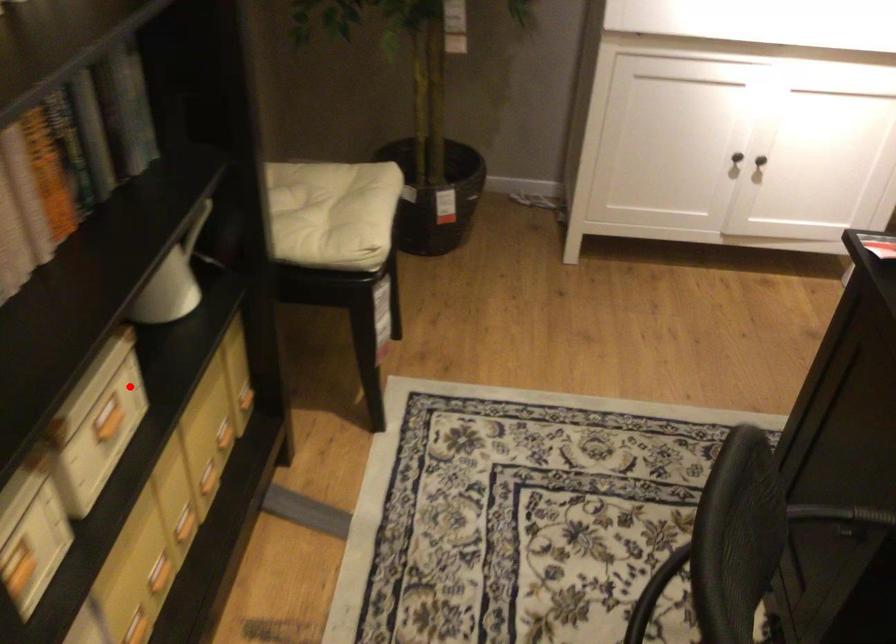
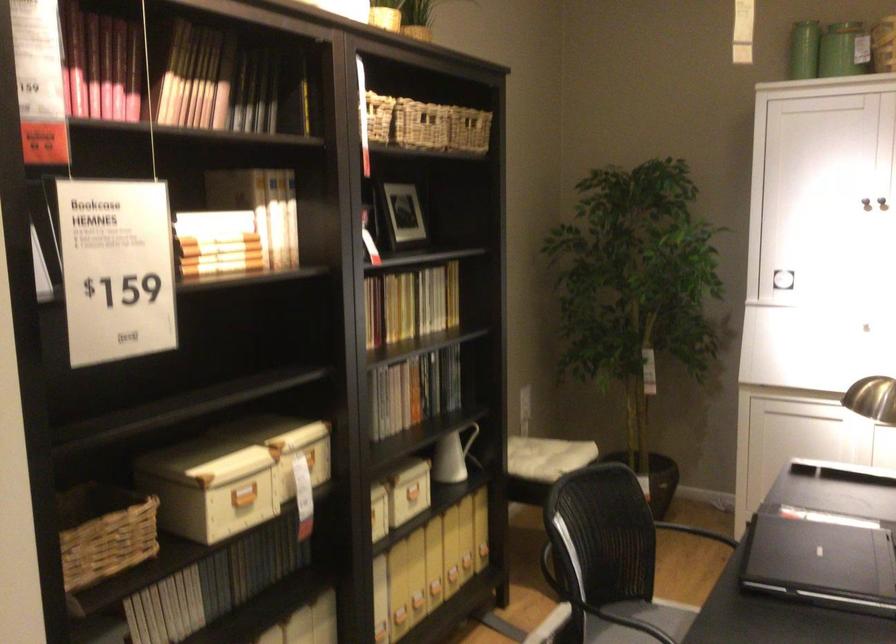
Find the pixel in the second image that matches the highlighted location in the first image.

(418, 491)